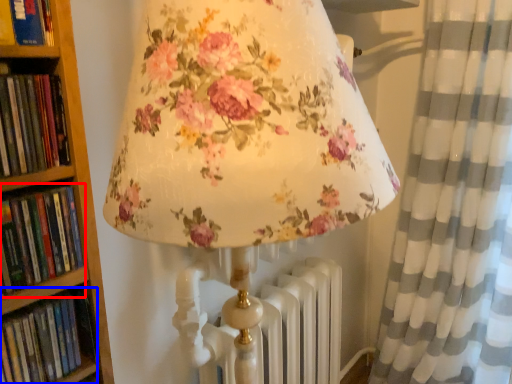
Question: Which object appears farthest to the camera in this image, book (highlighted by a red box) or book (highlighted by a blue box)?

Choices:
 (A) book
 (B) book

Answer: (B)